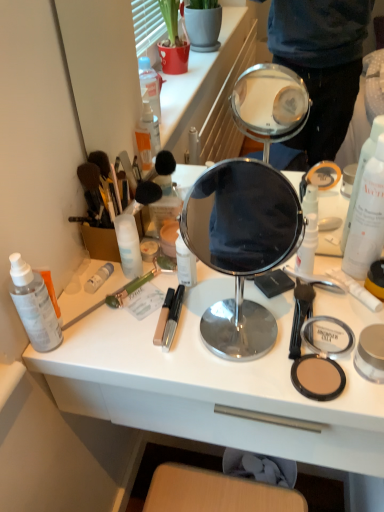
Where is `vacant area that lies in front of white matte bottle at center-left, acting as the fourth toiletry starting from the left`? Image resolution: width=384 pixels, height=512 pixels. vacant area that lies in front of white matte bottle at center-left, acting as the fourth toiletry starting from the left is located at coordinates (144, 334).